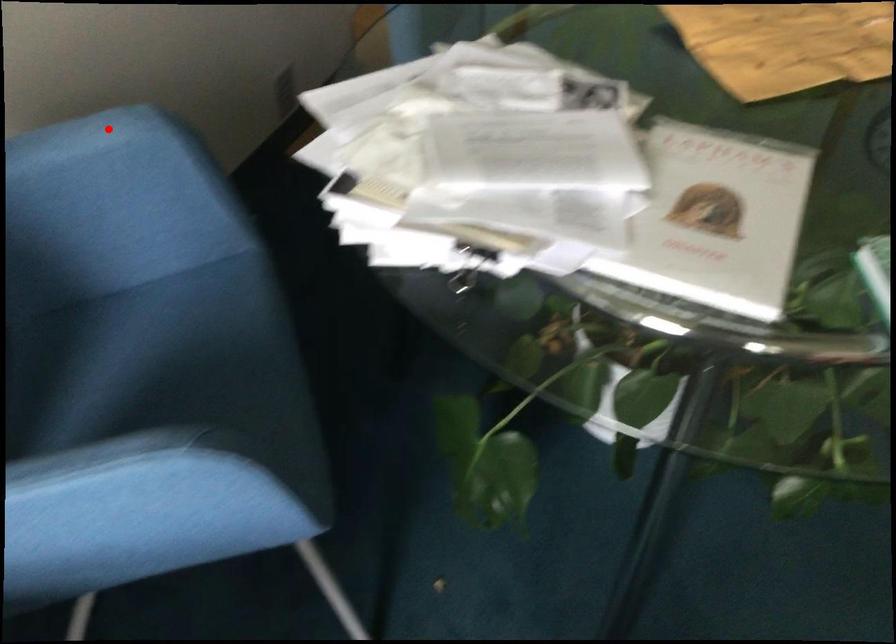
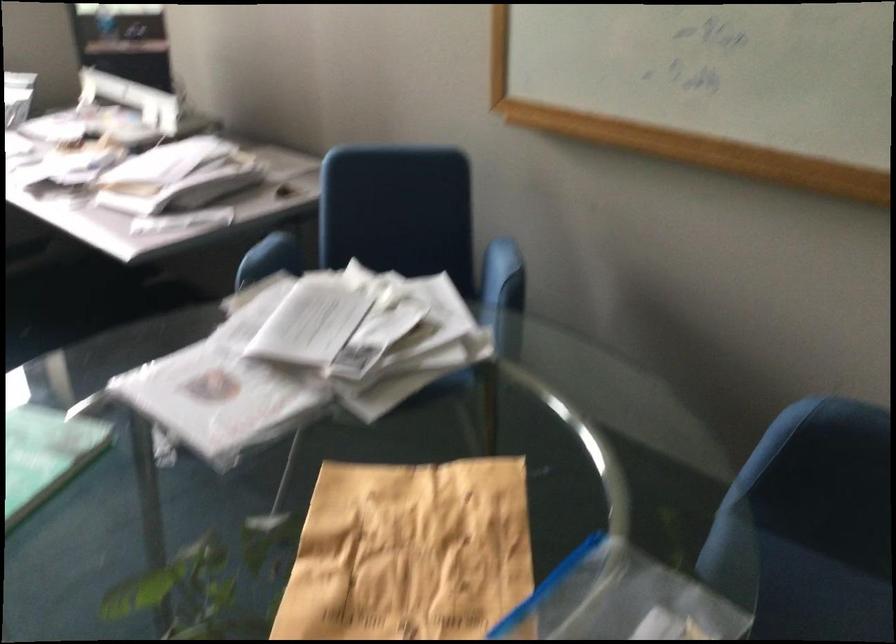
Question: A red point is marked in image1. In image2, is the corresponding 3D point closer to the camera or farther? Reply with the corresponding letter.

Choices:
 (A) The corresponding 3D point is closer.
 (B) The corresponding 3D point is farther.

Answer: (B)